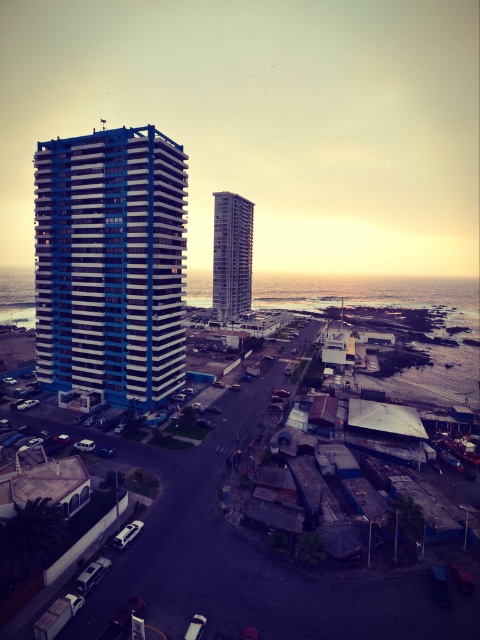
Is blue glossy building at center thinner than smooth glass building at center?

Incorrect, blue glossy building at center's width is not less than smooth glass building at center's.

Does blue glossy building at center come behind smooth glass building at center?

No, blue glossy building at center is in front of smooth glass building at center.

What do you see at coordinates (110, 268) in the screenshot?
I see `blue glossy building at center` at bounding box center [110, 268].

What are the coordinates of `blue glossy building at center` in the screenshot? It's located at (110, 268).